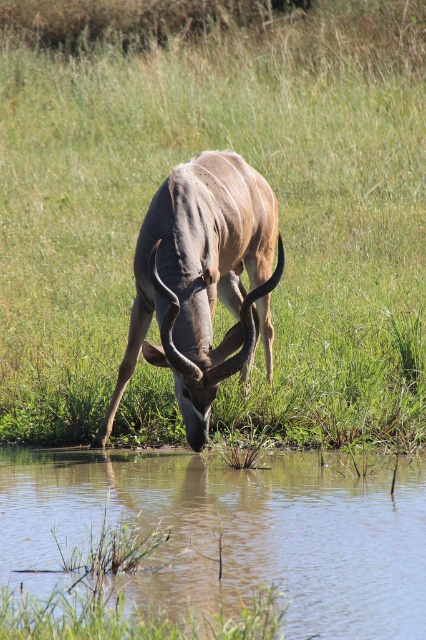
You are a photographer aiming to capture the kudu drinking water. To ensure the green grass at center is in the foreground of your photo, where should you position yourself relative to the kudu?

The green grass at center is located at point (192, 157), so you should position yourself closer to the grass to have it in the foreground while still framing the kudu drinking water in the background.

You are a photographer aiming to capture the kudu drinking water. The kudu is positioned at the center of the image. To ensure the reflection of the kudu in the clear water at lower center is visible, where should you focus your camera? Use the coordinates provided in the description to determine the answer.

The clear water at lower center is located at coordinates point (233, 532). To capture the reflection, focus your camera at that point to ensure the reflection of the kudu is visible in the clear water at lower center.